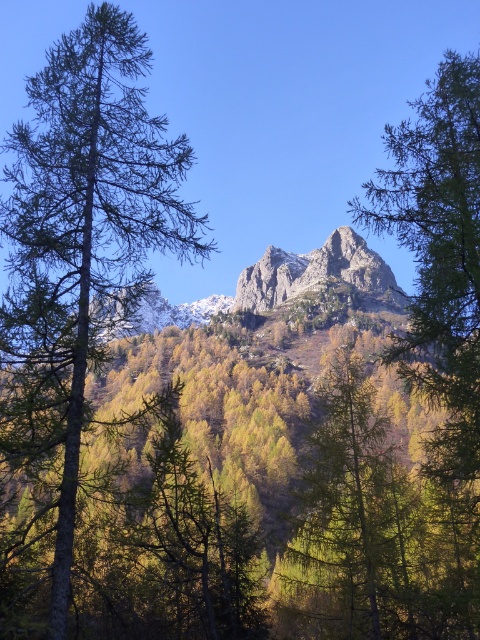
Which of these two, green needle-like tree at left or rugged stone mountain at center, stands taller?

A: Standing taller between the two is green needle-like tree at left.

Can you confirm if green needle-like tree at left is thinner than rugged stone mountain at center?

Yes.

Is point (64, 76) behind point (344, 227)?

No, it is not.

Where is `green needle-like tree at left`? Image resolution: width=480 pixels, height=640 pixels. green needle-like tree at left is located at coordinates (93, 204).